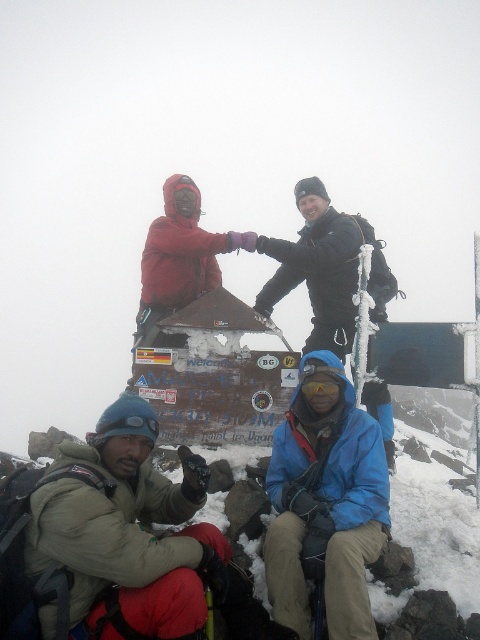
In the scene shown: You are a photographer positioned at the summit of Mount Kilimanjaro. You want to take a photo of the beige fleece jacket at lower left and the blue softshell jacket at lower right. Which jacket should you focus on first to ensure both are in sharp focus?

The beige fleece jacket at lower left is closer to the viewer than the blue softshell jacket at lower right, so focusing on the beige fleece jacket at lower left first will ensure both are in sharp focus.

You are a photographer trying to capture a photo of the beige fleece jacket at lower left and the blue softshell jacket at lower right. Since the weather is foggy, you want to ensure both are visible in the frame. Given their positions, which jacket will appear closer to the top of your photo?

The beige fleece jacket at lower left will appear closer to the top of the photo because it is positioned above the blue softshell jacket at lower right.